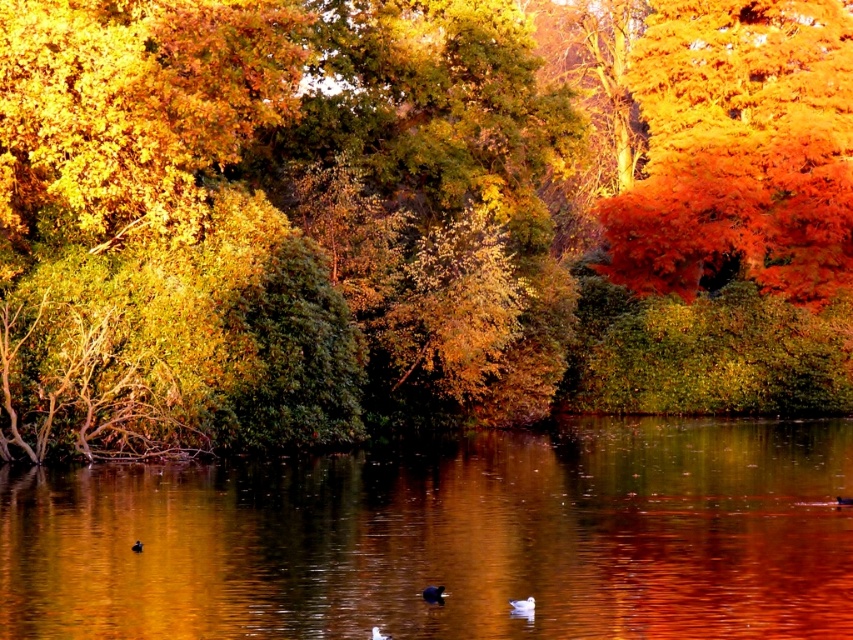
You are standing on the lakeshore observing the black matte duck at center and the white matte duck at lower center. Which duck is closer to you?

The black matte duck at center is closer to you because it is further to the viewer than the white matte duck at lower center.

You are standing at the origin point in the image. There are two points marked in the scene, point (514, 608) and point (379, 628). Which point is closer to you?

Point (379, 628) is closer to you because it is in front of point (514, 608).

You are a photographer aiming to capture both the black matte duck at center and the white matte duck at lower center in a single shot. Which duck will appear bigger in your photo?

The black matte duck at center will appear bigger in the photo because it is larger in size than the white matte duck at lower center.